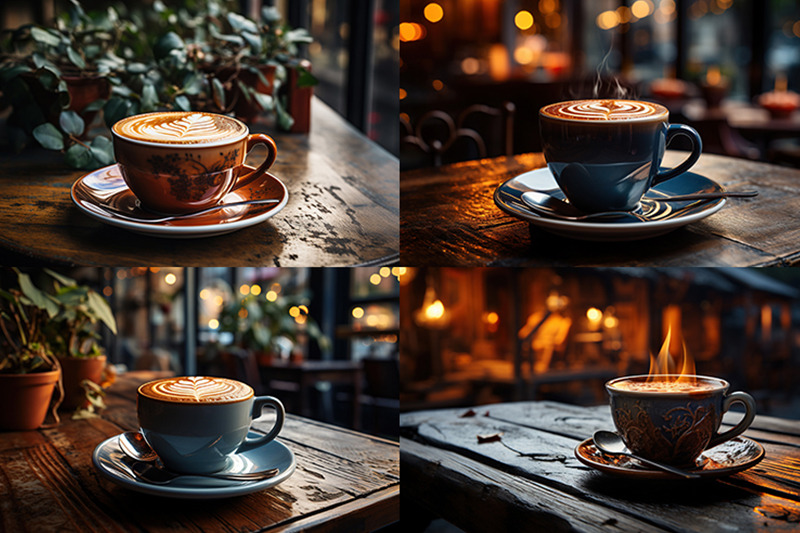
In order to click on coffee cup in this screenshot , I will do `click(224, 159)`, `click(213, 395)`, `click(645, 399)`, `click(586, 157)`.